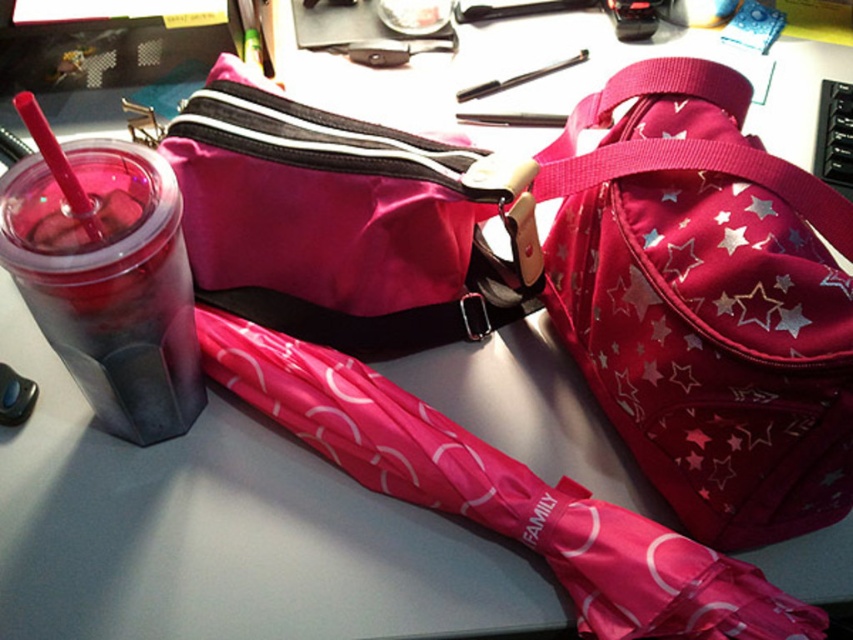
Question: Estimate the real-world distances between objects in this image. Which object is farther from the transparent plastic cup with straw at left?

Choices:
 (A) pink plastic straw at left
 (B) shiny pink fabric bag at upper right
 (C) metallic silver pen at upper center

Answer: (C)

Question: Does transparent plastic cup with straw at left appear on the left side of pink plastic straw at left?

Choices:
 (A) yes
 (B) no

Answer: (B)

Question: Which of the following is the farthest from the observer?

Choices:
 (A) transparent plastic cup with straw at left
 (B) metallic silver pen at upper center
 (C) pink plastic straw at left

Answer: (B)

Question: Considering the relative positions of shiny pink fabric bag at upper right and metallic silver pen at upper center in the image provided, where is shiny pink fabric bag at upper right located with respect to metallic silver pen at upper center?

Choices:
 (A) below
 (B) above

Answer: (A)

Question: Considering the relative positions of shiny pink fabric bag at upper right and pink plastic straw at left in the image provided, where is shiny pink fabric bag at upper right located with respect to pink plastic straw at left?

Choices:
 (A) left
 (B) right

Answer: (B)

Question: Among these objects, which one is farthest from the camera?

Choices:
 (A) metallic silver pen at upper center
 (B) pink plastic straw at left
 (C) transparent plastic cup with straw at left

Answer: (A)